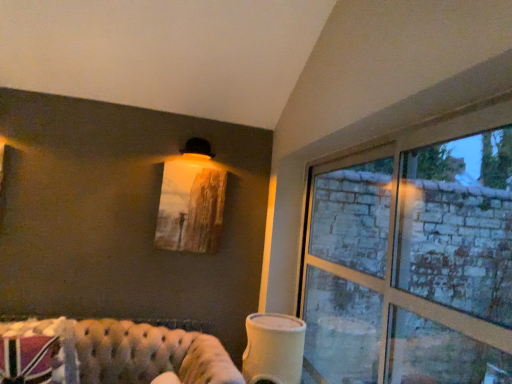
Question: Does white matte cup at lower center have a greater width compared to clear glass window at right?

Choices:
 (A) yes
 (B) no

Answer: (A)

Question: Could you tell me if white matte cup at lower center is turned towards clear glass window at right?

Choices:
 (A) yes
 (B) no

Answer: (B)

Question: From the image's perspective, is white matte cup at lower center on top of clear glass window at right?

Choices:
 (A) no
 (B) yes

Answer: (A)

Question: Does white matte cup at lower center appear on the right side of clear glass window at right?

Choices:
 (A) no
 (B) yes

Answer: (A)

Question: Considering the relative positions of white matte cup at lower center and clear glass window at right in the image provided, is white matte cup at lower center behind clear glass window at right?

Choices:
 (A) yes
 (B) no

Answer: (A)

Question: From the image's perspective, is white matte cup at lower center located beneath clear glass window at right?

Choices:
 (A) yes
 (B) no

Answer: (A)

Question: Is clear glass window at right smaller than white matte cup at lower center?

Choices:
 (A) no
 (B) yes

Answer: (B)

Question: Would you say clear glass window at right is outside white matte cup at lower center?

Choices:
 (A) no
 (B) yes

Answer: (B)

Question: Is clear glass window at right thinner than white matte cup at lower center?

Choices:
 (A) no
 (B) yes

Answer: (B)

Question: Is clear glass window at right further to camera compared to white matte cup at lower center?

Choices:
 (A) yes
 (B) no

Answer: (B)

Question: From a real-world perspective, does clear glass window at right stand above white matte cup at lower center?

Choices:
 (A) no
 (B) yes

Answer: (B)

Question: Is clear glass window at right positioned in front of white matte cup at lower center?

Choices:
 (A) yes
 (B) no

Answer: (A)

Question: Is white matte cup at lower center further to camera compared to tufted leather couch at lower left?

Choices:
 (A) yes
 (B) no

Answer: (A)